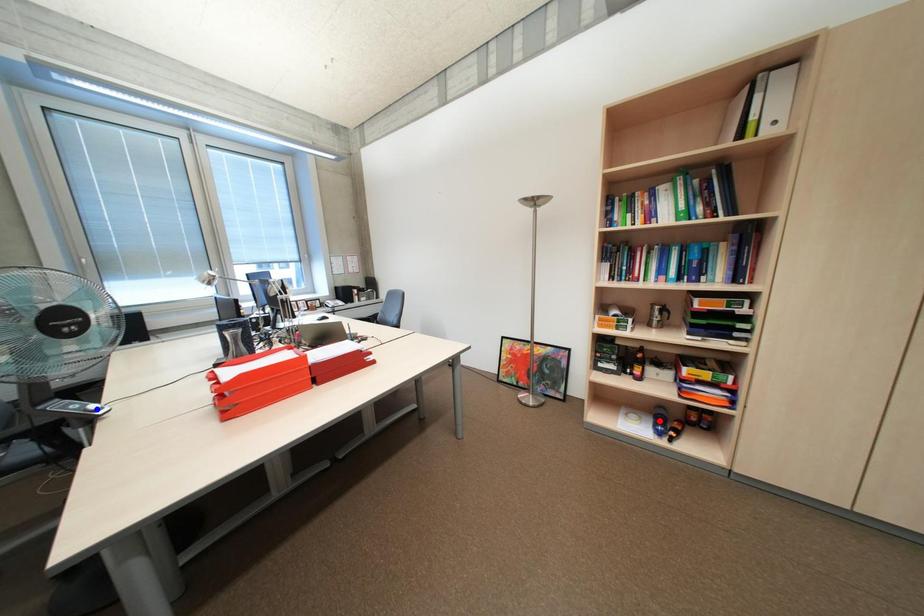
Question: In the image, two points are highlighted. Which point is nearer to the camera? Reply with the corresponding letter.

Choices:
 (A) blue point
 (B) red point

Answer: (A)